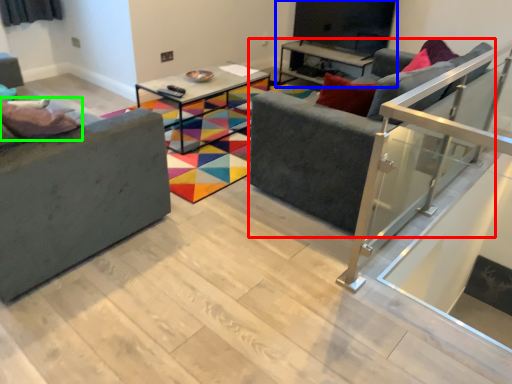
Question: Which object is the closest to the studio couch (highlighted by a red box)? Choose among these: entertainment center (highlighted by a blue box) or pillow (highlighted by a green box).

Choices:
 (A) entertainment center
 (B) pillow

Answer: (B)